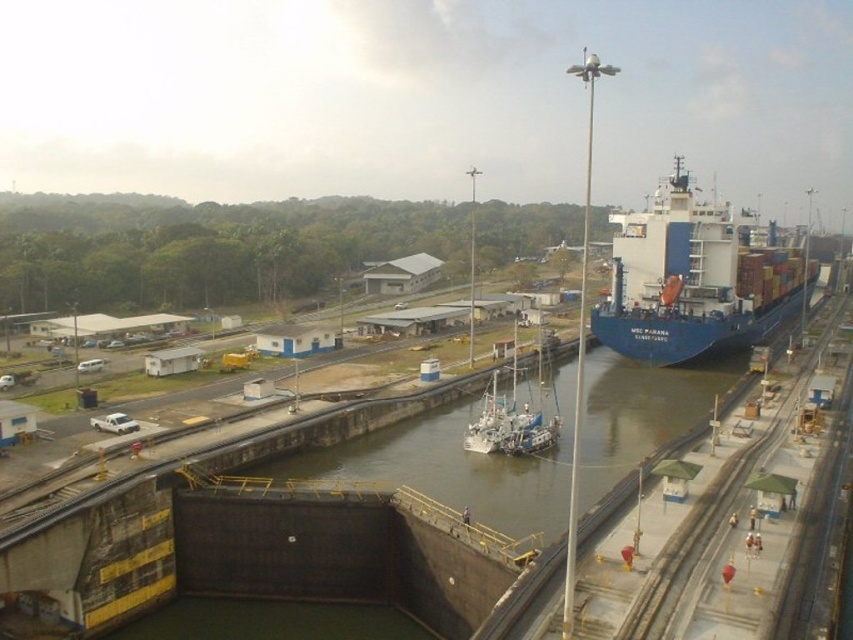
Question: Can you confirm if blue matte container ship at right is bigger than white matte boat at center?

Choices:
 (A) yes
 (B) no

Answer: (A)

Question: Among these objects, which one is farthest from the camera?

Choices:
 (A) blue matte container ship at right
 (B) white matte boat at center

Answer: (A)

Question: Can you confirm if blue matte container ship at right is smaller than white matte boat at center?

Choices:
 (A) yes
 (B) no

Answer: (B)

Question: Does blue matte container ship at right appear on the right side of white matte boat at center?

Choices:
 (A) no
 (B) yes

Answer: (B)